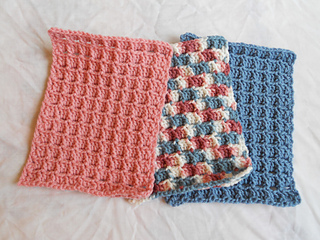
Locate an element on the screen. The height and width of the screenshot is (240, 320). wrinkles in bottom part of bedding is located at coordinates (171, 219), (142, 221), (108, 218), (95, 211), (44, 212), (244, 225), (293, 219).